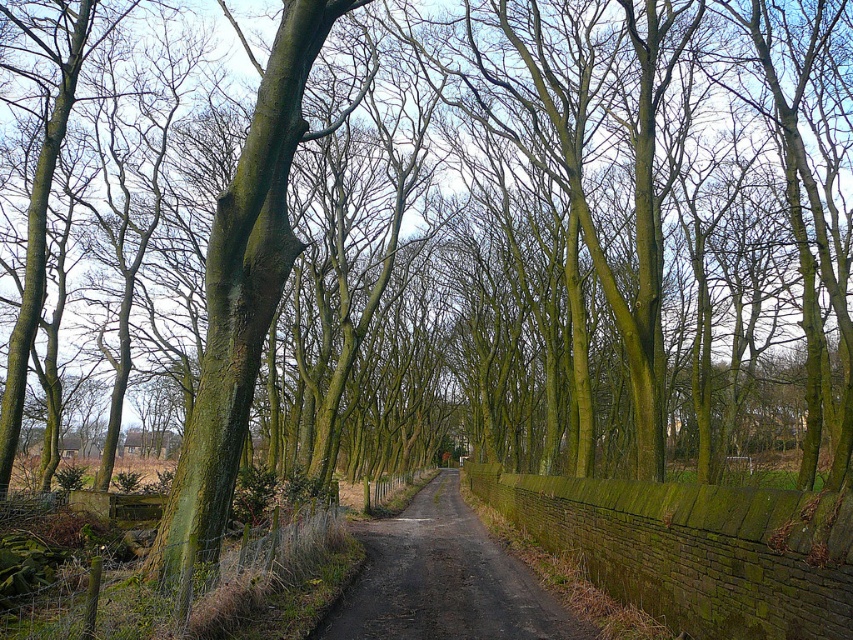
You are a hiker standing at the start of the narrow unpaved road surrounded by tall leafless trees. You notice a green mossy wire at lower left. Based on its position, can you determine if it is near the beginning of the road or further ahead along the path?

The green mossy wire at lower left is located at point (198, 588), which suggests it is positioned near the beginning of the road since lower coordinates typically indicate proximity to the starting point.

You are a hiker who wants to cross the narrow road in the scene. You notice the green mossy wire at lower left and the dark brown asphalt at center. Which object is shorter in height?

The green mossy wire at lower left is not as tall as the dark brown asphalt at center, so the green mossy wire at lower left is shorter in height.

You are a hiker carrying a large backpack and need to cross the green mossy wire at lower left and the dark brown asphalt at center. Which path is more suitable for carrying heavy items?

The dark brown asphalt at center is more suitable for carrying heavy items because it has a larger size compared to the green mossy wire at lower left.